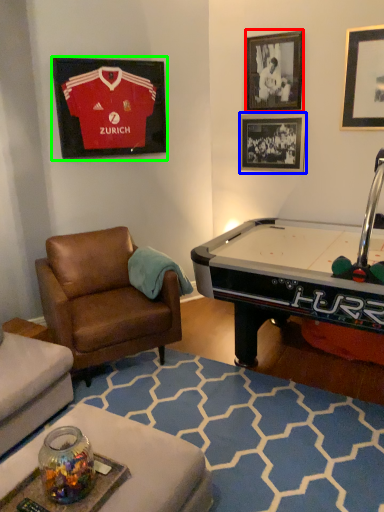
Question: Considering the real-world distances, which object is farthest from picture frame (highlighted by a red box)? picture frame (highlighted by a blue box) or picture frame (highlighted by a green box)?

Choices:
 (A) picture frame
 (B) picture frame

Answer: (B)